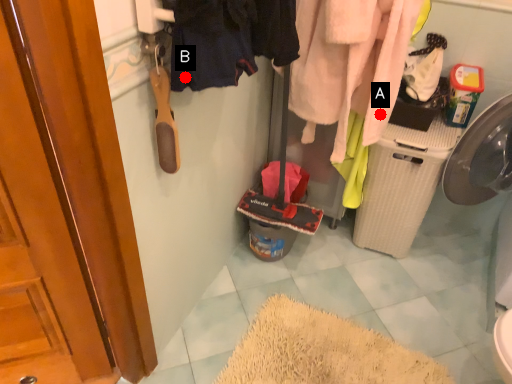
Question: Two points are circled on the image, labeled by A and B beside each circle. Which point is closer to the camera taking this photo?

Choices:
 (A) A is closer
 (B) B is closer

Answer: (B)